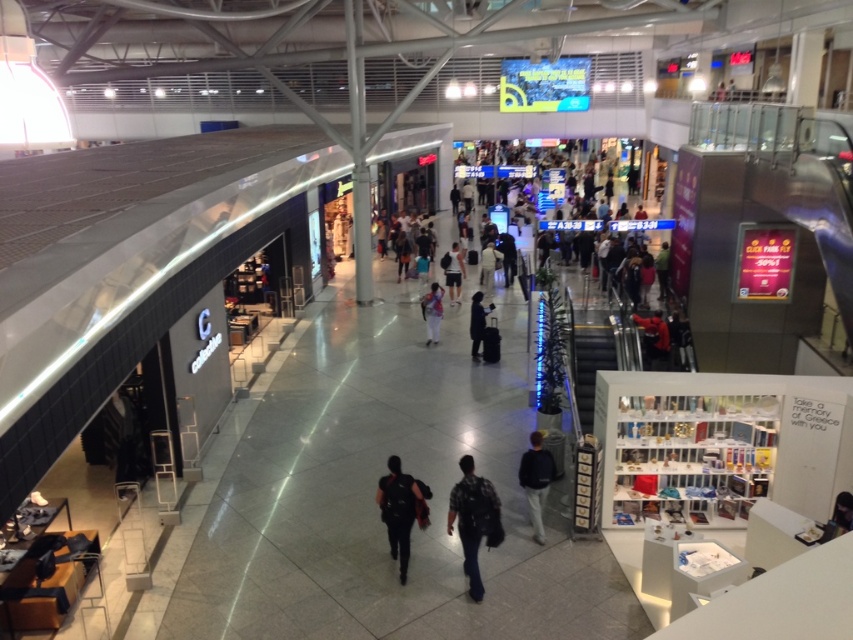
Looking at this image, you are a store manager checking inventory in the Calvin Klein store. You have two items displayed outside the store entrance, a plaid shirt at center and a dark blue fabric jacket at center. Which item takes up more horizontal space when laid flat?

The plaid shirt at center has a larger width than the dark blue fabric jacket at center, so it takes up more horizontal space when laid flat.

You are standing in the shopping mall and want to move from the Calvin Klein store entrance to the seating area. The path you need to take goes through two specific points marked as point 1 at coordinates (450, 513) and point 2 at coordinates (473, 344). Which point should you step on first to ensure you are moving towards the seating area?

You should step on point 1 at coordinates (450, 513) first because it is closer to the viewer, meaning it is on the path leading towards the seating area.

You are a delivery person carrying a large box that is 1.5 meters wide. You need to move from the Calvin Klein store entrance to the dark blue sweater at center without passing through any obstacles. Is there enough space between them for you to pass through?

The distance between the Calvin Klein store entrance and the dark blue sweater at center is 9.37 meters, so yes, there is sufficient space for the delivery person to pass through with their 1.5 meter wide box.